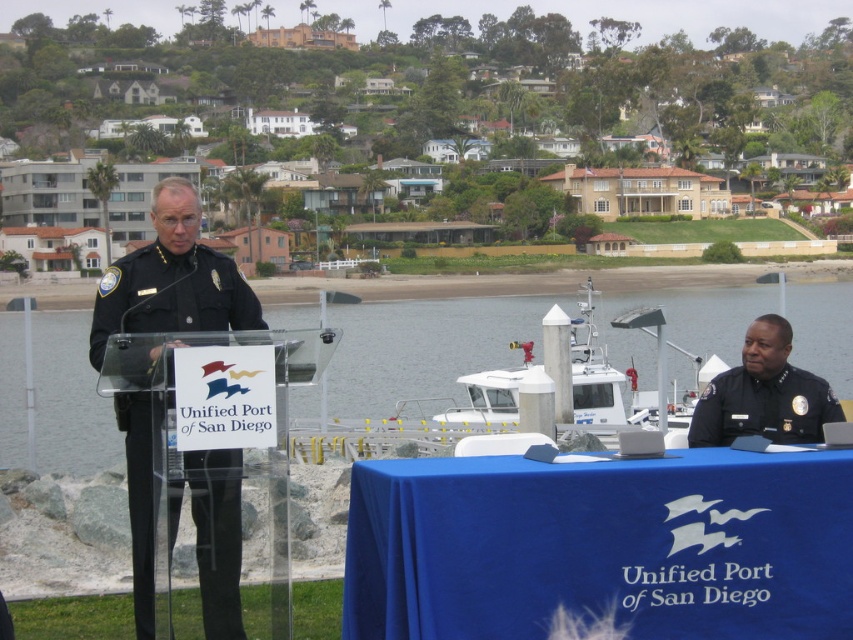
Question: Based on their relative distances, which object is farther from the clear water at center?

Choices:
 (A) black uniform at right
 (B) white plastic boat at center

Answer: (A)

Question: Which object appears farthest from the camera in this image?

Choices:
 (A) black uniform at right
 (B) blue fabric table at lower right
 (C) white plastic boat at center
 (D) black uniform at center

Answer: (A)

Question: Observing the image, what is the correct spatial positioning of blue fabric table at lower right in reference to white plastic boat at center?

Choices:
 (A) above
 (B) below

Answer: (B)

Question: Among these points, which one is farthest from the camera?

Choices:
 (A) coord(819,502)
 (B) coord(622,385)
 (C) coord(259,328)

Answer: (B)

Question: Is clear water at center thinner than black uniform at right?

Choices:
 (A) no
 (B) yes

Answer: (A)

Question: Is black uniform at center wider than black uniform at right?

Choices:
 (A) yes
 (B) no

Answer: (B)